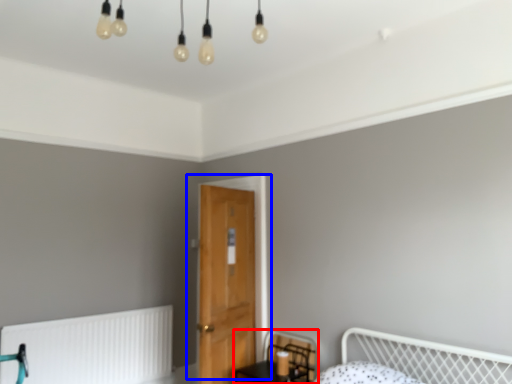
Question: Which point is further to the camera, swivel chair (highlighted by a red box) or door (highlighted by a blue box)?

Choices:
 (A) swivel chair
 (B) door

Answer: (B)